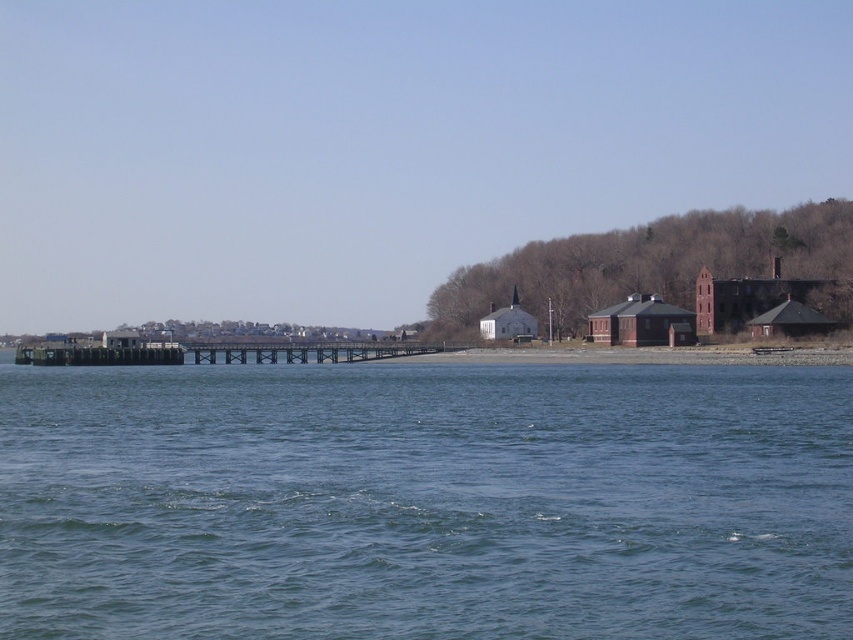
Question: Is the position of blue water at center less distant than that of brown wooden dock at center?

Choices:
 (A) yes
 (B) no

Answer: (A)

Question: Which point is closer to the camera?

Choices:
 (A) blue water at center
 (B) brown wooden dock at center

Answer: (A)

Question: Among these objects, which one is farthest from the camera?

Choices:
 (A) brown wooden dock at center
 (B) blue water at center

Answer: (A)

Question: Which object appears closest to the camera in this image?

Choices:
 (A) blue water at center
 (B) brown wooden dock at center

Answer: (A)

Question: Is blue water at center to the left of brown wooden dock at center from the viewer's perspective?

Choices:
 (A) yes
 (B) no

Answer: (B)

Question: In this image, where is blue water at center located relative to brown wooden dock at center?

Choices:
 (A) above
 (B) below

Answer: (B)